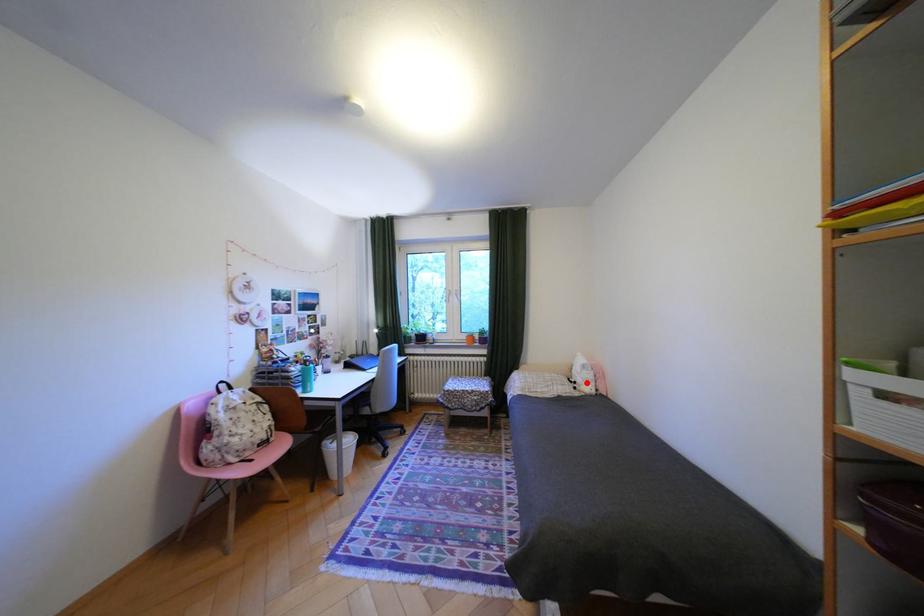
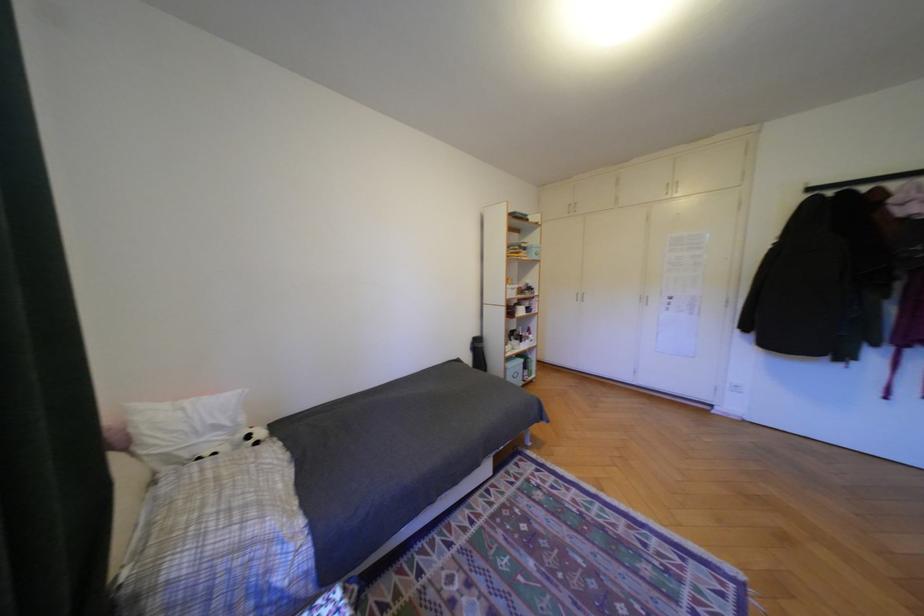
Where in the second image is the point corresponding to the highlighted location from the first image?

(261, 437)